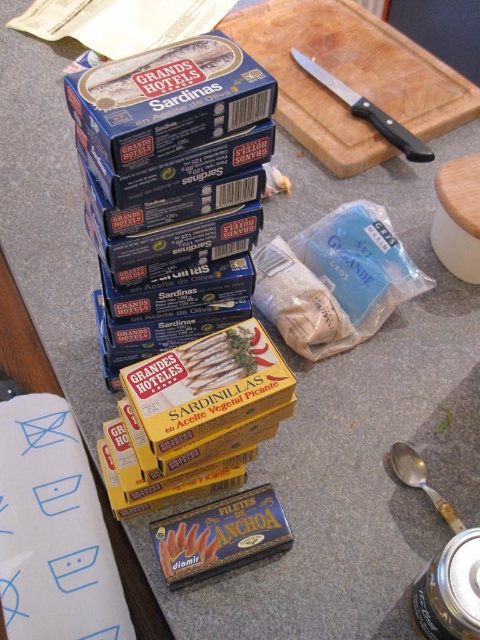
Question: Is wooden cutting board at upper right further to the viewer compared to blue cardboard box at upper center?

Choices:
 (A) yes
 (B) no

Answer: (A)

Question: Which object is farther from the camera taking this photo?

Choices:
 (A) orange matte fish at lower center
 (B) wooden cutting board at upper right
 (C) blue cardboard box at upper center

Answer: (B)

Question: Among these objects, which one is farthest from the camera?

Choices:
 (A) wooden cutting board at upper right
 (B) blue cardboard box at upper center
 (C) orange matte fish at lower center

Answer: (A)

Question: Which object appears closest to the camera in this image?

Choices:
 (A) orange matte fish at lower center
 (B) wooden cutting board at upper right
 (C) blue cardboard box at upper center

Answer: (C)

Question: Is wooden cutting board at upper right above blue cardboard box at upper center?

Choices:
 (A) yes
 (B) no

Answer: (A)

Question: Is blue cardboard box at upper center positioned in front of orange matte fish at lower center?

Choices:
 (A) no
 (B) yes

Answer: (B)